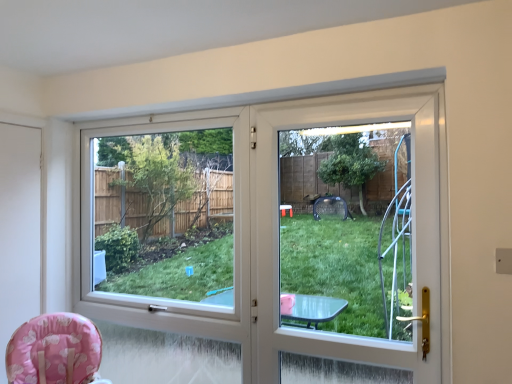
Question: Is pink fabric baby chair at lower left taller than white matte screen door at left, marked as the first screen door in a back-to-front arrangement?

Choices:
 (A) no
 (B) yes

Answer: (A)

Question: Is pink fabric baby chair at lower left positioned beyond the bounds of white matte screen door at left, which appears as the 1th screen door when viewed from the left?

Choices:
 (A) yes
 (B) no

Answer: (A)

Question: From a real-world perspective, does pink fabric baby chair at lower left stand above white matte screen door at left, marked as the first screen door in a back-to-front arrangement?

Choices:
 (A) no
 (B) yes

Answer: (A)

Question: Can you confirm if pink fabric baby chair at lower left is thinner than white matte screen door at left, marked as the first screen door in a back-to-front arrangement?

Choices:
 (A) no
 (B) yes

Answer: (A)

Question: Can you confirm if pink fabric baby chair at lower left is wider than white matte screen door at left, which is the 2th screen door from front to back?

Choices:
 (A) no
 (B) yes

Answer: (B)

Question: From the image's perspective, is white plastic screen door at center, placed as the first screen door when sorted from front to back, located above or below white matte screen door at left, which is the 2th screen door from front to back?

Choices:
 (A) above
 (B) below

Answer: (A)

Question: Considering the positions of point (316, 97) and point (37, 137), is point (316, 97) closer or farther from the camera than point (37, 137)?

Choices:
 (A) closer
 (B) farther

Answer: (A)

Question: From a real-world perspective, is white plastic screen door at center, which appears as the 1th screen door when viewed from the right, physically located above or below white matte screen door at left, which is the 2th screen door from front to back?

Choices:
 (A) below
 (B) above

Answer: (B)

Question: Based on their sizes in the image, would you say white plastic screen door at center, acting as the 2th screen door starting from the back, is bigger or smaller than white matte screen door at left, which appears as the 1th screen door when viewed from the left?

Choices:
 (A) big
 (B) small

Answer: (A)

Question: Considering the positions of transparent plastic window screen at center and pink fabric baby chair at lower left in the image, is transparent plastic window screen at center wider or thinner than pink fabric baby chair at lower left?

Choices:
 (A) thin
 (B) wide

Answer: (A)

Question: Looking at the image, does transparent plastic window screen at center seem bigger or smaller compared to pink fabric baby chair at lower left?

Choices:
 (A) big
 (B) small

Answer: (A)

Question: Is transparent plastic window screen at center taller or shorter than pink fabric baby chair at lower left?

Choices:
 (A) tall
 (B) short

Answer: (A)

Question: In the image, is transparent plastic window screen at center on the left side or the right side of pink fabric baby chair at lower left?

Choices:
 (A) left
 (B) right

Answer: (B)

Question: Looking at the image, does white matte screen door at left, which appears as the 1th screen door when viewed from the left, seem bigger or smaller compared to pink fabric baby chair at lower left?

Choices:
 (A) small
 (B) big

Answer: (A)

Question: Does point (36, 228) appear closer or farther from the camera than point (84, 375)?

Choices:
 (A) farther
 (B) closer

Answer: (A)